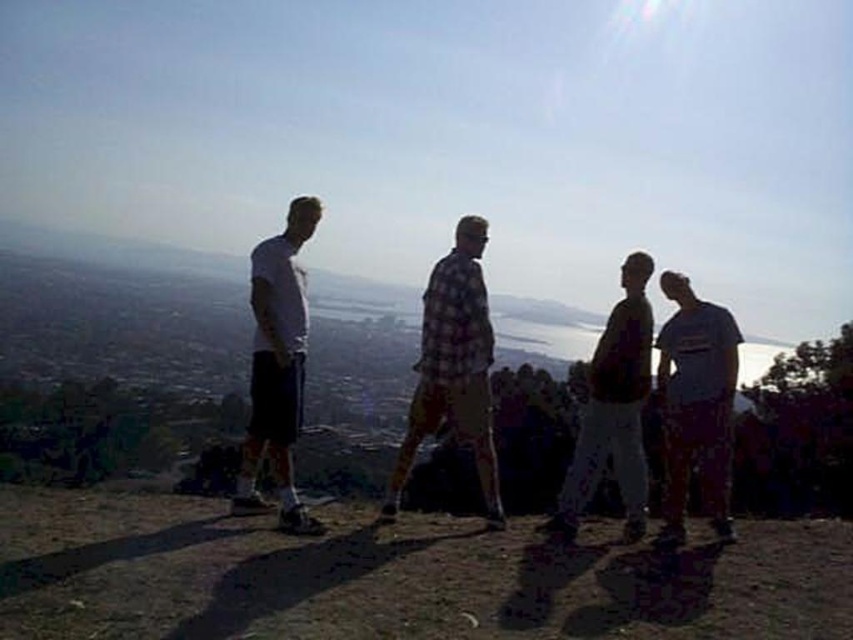
Question: Which object is positioned farthest from the gray cotton t-shirt at right?

Choices:
 (A) dark brown leather jacket at center
 (B) white matte t-shirt at left

Answer: (B)

Question: Which object is closer to the camera taking this photo?

Choices:
 (A) gray cotton t-shirt at right
 (B) checkered fabric shirt at center
 (C) white matte t-shirt at left

Answer: (C)

Question: Does checkered fabric shirt at center come behind gray cotton t-shirt at right?

Choices:
 (A) yes
 (B) no

Answer: (A)

Question: Estimate the real-world distances between objects in this image. Which object is closer to the dark brown leather jacket at center?

Choices:
 (A) white matte t-shirt at left
 (B) checkered fabric shirt at center
 (C) gray cotton t-shirt at right

Answer: (C)

Question: Is gray cotton t-shirt at right further to camera compared to white matte t-shirt at left?

Choices:
 (A) yes
 (B) no

Answer: (A)

Question: Can you confirm if gray cotton t-shirt at right is bigger than dark brown leather jacket at center?

Choices:
 (A) yes
 (B) no

Answer: (A)